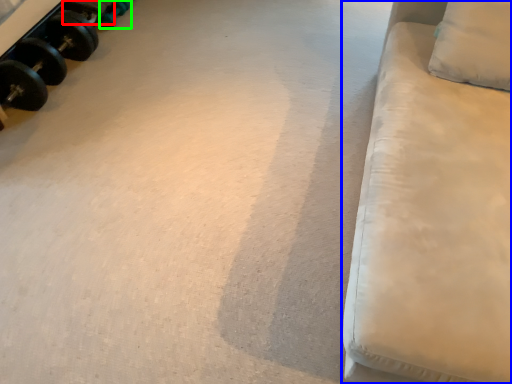
Question: Which object is the farthest from dumbbell (highlighted by a red box)? Choose among these: furniture (highlighted by a blue box) or dumbbell (highlighted by a green box).

Choices:
 (A) furniture
 (B) dumbbell

Answer: (A)